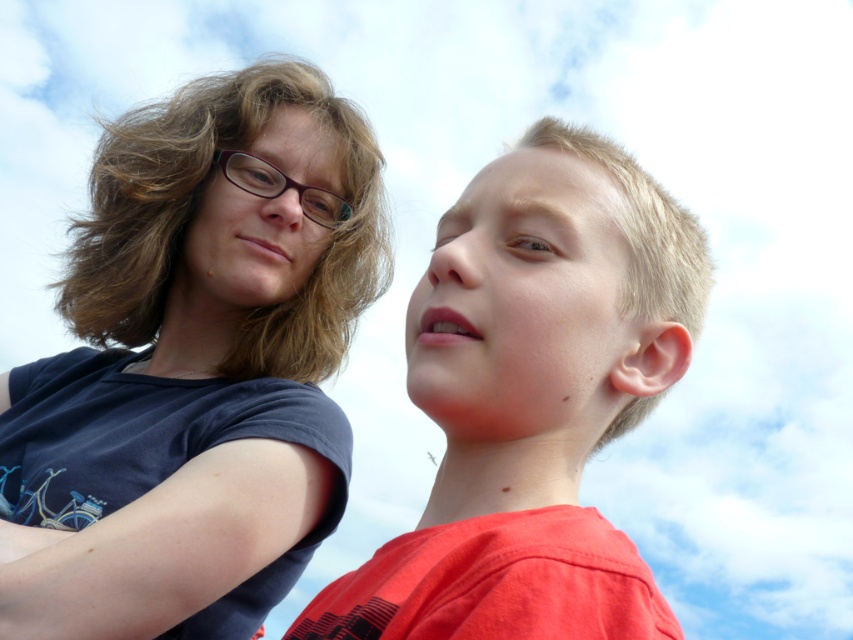
Question: Which point is farther from the camera taking this photo?

Choices:
 (A) (97, 570)
 (B) (497, 300)

Answer: (A)

Question: Can you confirm if smooth red shirt at right is smaller than purple plastic glasses at upper left?

Choices:
 (A) no
 (B) yes

Answer: (A)

Question: Which of the following is the closest to the observer?

Choices:
 (A) smooth red shirt at right
 (B) purple plastic glasses at upper left

Answer: (A)

Question: From the image, what is the correct spatial relationship of smooth red shirt at right in relation to purple plastic glasses at upper left?

Choices:
 (A) left
 (B) right

Answer: (B)

Question: Observing the image, what is the correct spatial positioning of smooth red shirt at right in reference to purple plastic glasses at upper left?

Choices:
 (A) left
 (B) right

Answer: (B)

Question: Which of the following is the closest to the observer?

Choices:
 (A) smooth red shirt at right
 (B) matte blue shirt at upper left
 (C) purple plastic glasses at upper left

Answer: (A)